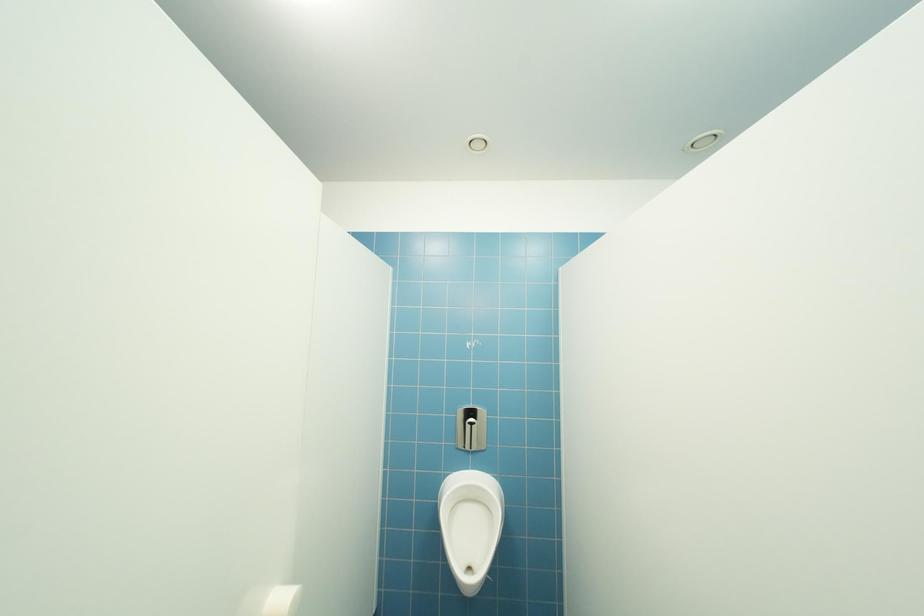
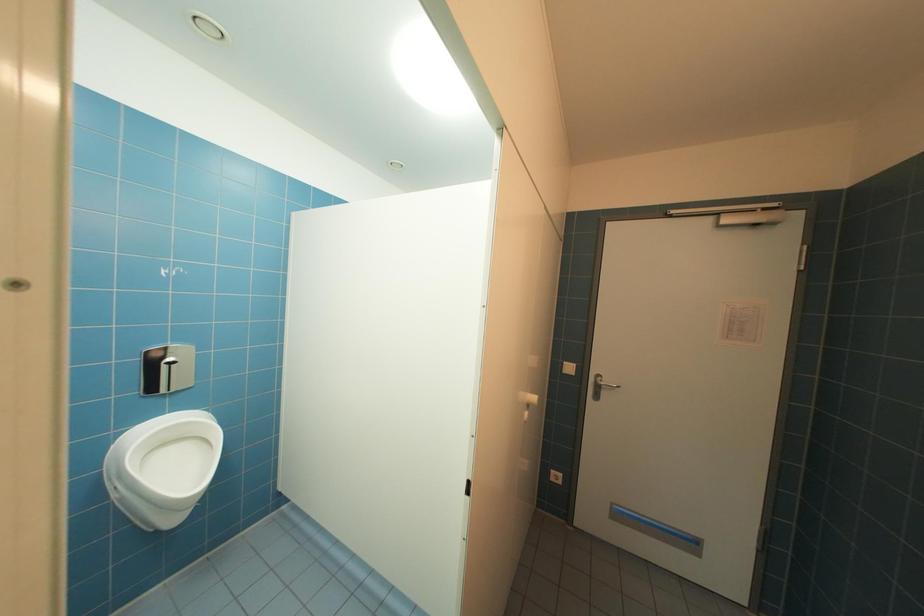
Question: The images are taken continuously from a first-person perspective. In which direction is your viewpoint rotating?

Choices:
 (A) Left
 (B) Right
 (C) Up
 (D) Down

Answer: (B)